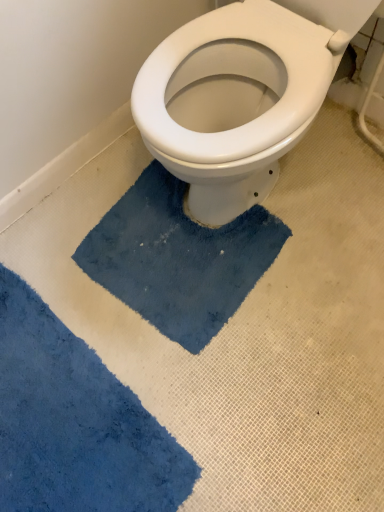
Question: Is blue plush bath mat at center, which is the first bath mat in top-to-bottom order, completely or partially outside of blue soft rug at lower left, the second bath mat positioned from the top?

Choices:
 (A) yes
 (B) no

Answer: (A)

Question: Is blue plush bath mat at center, which is the first bath mat in top-to-bottom order, surrounding blue soft rug at lower left, the first bath mat from the bottom?

Choices:
 (A) yes
 (B) no

Answer: (B)

Question: Could you tell me if blue plush bath mat at center, which is the second bath mat in bottom-to-top order, is facing blue soft rug at lower left, the first bath mat from the bottom?

Choices:
 (A) yes
 (B) no

Answer: (A)

Question: From the image's perspective, is blue plush bath mat at center, which is the first bath mat in top-to-bottom order, beneath blue soft rug at lower left, the second bath mat positioned from the top?

Choices:
 (A) yes
 (B) no

Answer: (B)

Question: Considering the relative sizes of blue plush bath mat at center, which is the second bath mat in bottom-to-top order, and blue soft rug at lower left, the first bath mat from the bottom, in the image provided, is blue plush bath mat at center, which is the second bath mat in bottom-to-top order, shorter than blue soft rug at lower left, the first bath mat from the bottom,?

Choices:
 (A) yes
 (B) no

Answer: (B)

Question: Is blue plush bath mat at center, which is the second bath mat in bottom-to-top order, looking in the opposite direction of blue soft rug at lower left, the first bath mat from the bottom?

Choices:
 (A) no
 (B) yes

Answer: (A)

Question: Does blue soft rug at lower left, the first bath mat from the bottom, lie behind blue plush bath mat at center, which is the second bath mat in bottom-to-top order?

Choices:
 (A) yes
 (B) no

Answer: (B)

Question: Considering the relative positions of blue soft rug at lower left, the second bath mat positioned from the top, and blue plush bath mat at center, which is the second bath mat in bottom-to-top order, in the image provided, is blue soft rug at lower left, the second bath mat positioned from the top, to the left of blue plush bath mat at center, which is the second bath mat in bottom-to-top order, from the viewer's perspective?

Choices:
 (A) no
 (B) yes

Answer: (B)

Question: From a real-world perspective, is blue soft rug at lower left, the first bath mat from the bottom, beneath blue plush bath mat at center, which is the first bath mat in top-to-bottom order?

Choices:
 (A) yes
 (B) no

Answer: (A)

Question: Can you confirm if blue soft rug at lower left, the first bath mat from the bottom, is wider than blue plush bath mat at center, which is the second bath mat in bottom-to-top order?

Choices:
 (A) no
 (B) yes

Answer: (A)

Question: Is the surface of blue soft rug at lower left, the first bath mat from the bottom, in direct contact with blue plush bath mat at center, which is the first bath mat in top-to-bottom order?

Choices:
 (A) no
 (B) yes

Answer: (A)

Question: From the image's perspective, is blue soft rug at lower left, the first bath mat from the bottom, on top of blue plush bath mat at center, which is the second bath mat in bottom-to-top order?

Choices:
 (A) yes
 (B) no

Answer: (B)

Question: Would you say blue soft rug at lower left, the first bath mat from the bottom, is to the left or to the right of blue plush bath mat at center, which is the first bath mat in top-to-bottom order, in the picture?

Choices:
 (A) right
 (B) left

Answer: (B)